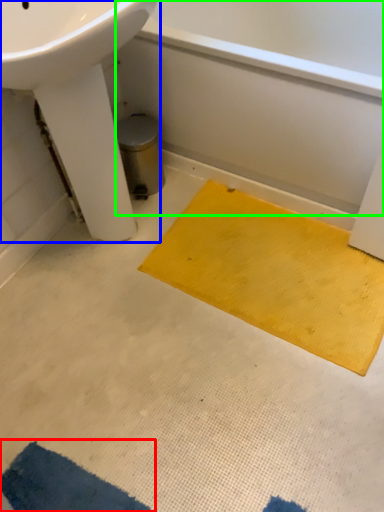
Question: Which object is the closest to the doormat (highlighted by a red box)? Choose among these: sink (highlighted by a blue box) or bath (highlighted by a green box).

Choices:
 (A) sink
 (B) bath

Answer: (A)